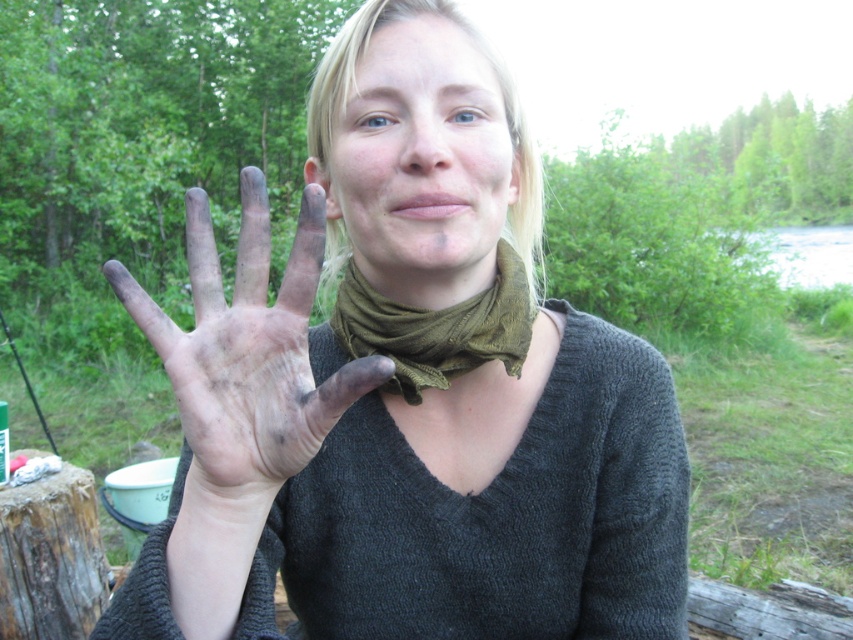
Question: Considering the relative positions of dirty clay hand at center and green fabric scarf at center in the image provided, where is dirty clay hand at center located with respect to green fabric scarf at center?

Choices:
 (A) above
 (B) below

Answer: (B)

Question: Based on their relative distances, which object is farther from the green fabric scarf at center?

Choices:
 (A) dirty skin at center
 (B) dirty clay hand at center

Answer: (B)

Question: Can you confirm if dirty skin at center is positioned below dirty clay hand at center?

Choices:
 (A) yes
 (B) no

Answer: (B)

Question: From the image, what is the correct spatial relationship of dirty skin at center in relation to green fabric scarf at center?

Choices:
 (A) right
 (B) left

Answer: (B)

Question: Among these points, which one is farthest from the camera?

Choices:
 (A) (236, 358)
 (B) (387, 305)

Answer: (B)

Question: Which point is closer to the camera?

Choices:
 (A) dirty clay hand at center
 (B) dirty skin at center

Answer: (A)